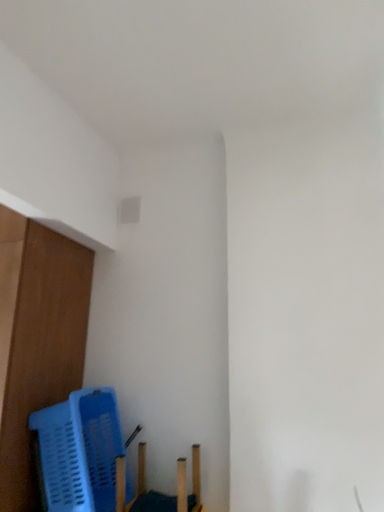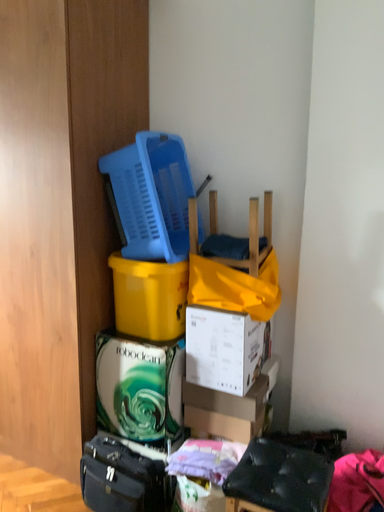
Question: Which way did the camera rotate in the video?

Choices:
 (A) rotated right
 (B) rotated left

Answer: (B)